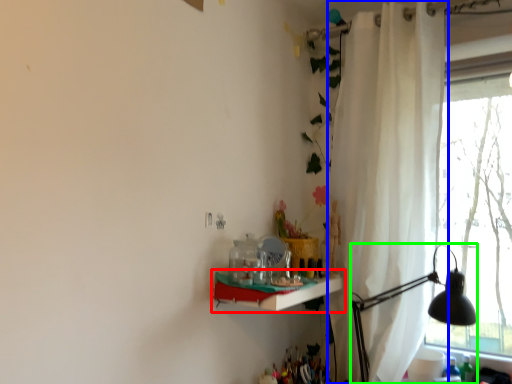
Question: Estimate the real-world distances between objects in this image. Which object is farther from shelf (highlighted by a red box), curtain (highlighted by a blue box) or table lamp (highlighted by a green box)?

Choices:
 (A) curtain
 (B) table lamp

Answer: (A)